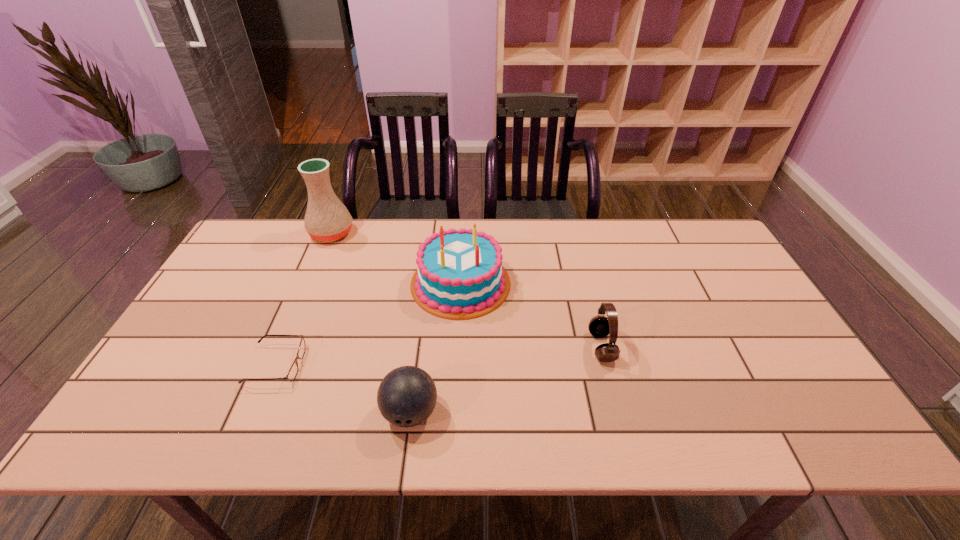
Image resolution: width=960 pixels, height=540 pixels. Identify the location of the tallest object. (327, 219).

Where is `pottery`? pottery is located at coordinates pos(327,219).

The width and height of the screenshot is (960, 540). What are the coordinates of `the second farthest object` in the screenshot? It's located at (x=459, y=275).

You are a GUI agent. You are given a task and a screenshot of the screen. Output one action in this format:
    pyautogui.click(x=<x>, y=<y>)
    Task: Click on the birthday cake
    
    Given the screenshot: What is the action you would take?
    pyautogui.click(x=459, y=275)

At what (x,y) coordinates should I click in order to perform the action: click on headset. Please return your answer as a coordinate pair (x, y). This screenshot has width=960, height=540. Looking at the image, I should click on (600, 326).

You are a GUI agent. You are given a task and a screenshot of the screen. Output one action in this format:
    pyautogui.click(x=<x>, y=<y>)
    Task: Click on the bowling ball
    The height and width of the screenshot is (540, 960).
    Given the screenshot: What is the action you would take?
    pyautogui.click(x=406, y=397)

At what (x,y) coordinates should I click in order to perform the action: click on spectacles. Please return your answer as a coordinate pair (x, y). The height and width of the screenshot is (540, 960). Looking at the image, I should click on (293, 371).

Find the location of a particular element. Image resolution: width=960 pixels, height=540 pixels. free location located 0.300m on the right of the tallest object is located at coordinates (443, 233).

This screenshot has height=540, width=960. I want to click on vacant space located on the left of the second farthest object, so click(334, 284).

Identify the location of vacant position located on the ear pads of the rightmost object. Image resolution: width=960 pixels, height=540 pixels. (435, 347).